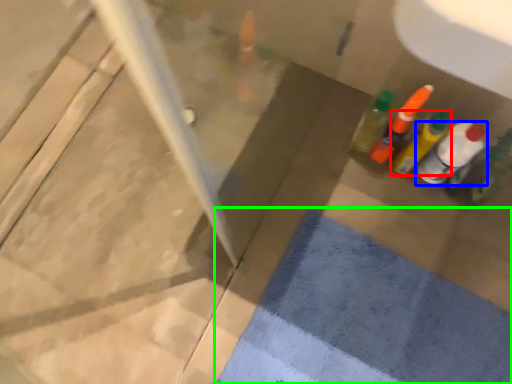
Question: Considering the real-world distances, which object is farthest from bottle (highlighted by a red box)? bottle (highlighted by a blue box) or bath mat (highlighted by a green box)?

Choices:
 (A) bottle
 (B) bath mat

Answer: (B)